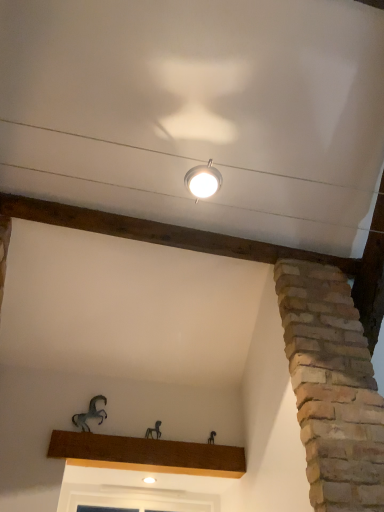
Question: Considering the relative sizes of metallic horse at center, the 1th animal in the right-to-left sequence, and metallic horse at lower left, placed as the second animal when sorted from bottom to top, in the image provided, is metallic horse at center, the 1th animal in the right-to-left sequence, smaller than metallic horse at lower left, placed as the second animal when sorted from bottom to top,?

Choices:
 (A) no
 (B) yes

Answer: (B)

Question: Is metallic horse at center, arranged as the first animal when ordered from the bottom, far from metallic horse at lower left, placed as the second animal when sorted from bottom to top?

Choices:
 (A) no
 (B) yes

Answer: (A)

Question: Is metallic horse at center, arranged as the first animal when ordered from the bottom, facing away from metallic horse at lower left, placed as the second animal when sorted from bottom to top?

Choices:
 (A) yes
 (B) no

Answer: (B)

Question: From a real-world perspective, is metallic horse at center, positioned as the second animal in top-to-bottom order, beneath metallic horse at lower left, which is the first animal from left to right?

Choices:
 (A) yes
 (B) no

Answer: (A)

Question: From the image's perspective, would you say metallic horse at center, positioned as the second animal in top-to-bottom order, is positioned over metallic horse at lower left, placed as the second animal when sorted from bottom to top?

Choices:
 (A) no
 (B) yes

Answer: (A)

Question: Is metallic horse at lower left, marked as the second animal in a right-to-left arrangement, taller or shorter than metallic horse at center, arranged as the first animal when ordered from the bottom?

Choices:
 (A) short
 (B) tall

Answer: (B)

Question: Which is correct: metallic horse at lower left, which is the first animal from left to right, is inside metallic horse at center, arranged as the first animal when ordered from the bottom, or outside of it?

Choices:
 (A) outside
 (B) inside

Answer: (A)

Question: Considering their positions, is metallic horse at lower left, placed as the second animal when sorted from bottom to top, located in front of or behind metallic horse at center, which appears as the 2th animal when viewed from the left?

Choices:
 (A) front
 (B) behind

Answer: (A)

Question: Based on their positions, is metallic horse at lower left, placed as the second animal when sorted from bottom to top, located to the left or right of metallic horse at center, the 1th animal in the right-to-left sequence?

Choices:
 (A) right
 (B) left

Answer: (B)

Question: In terms of height, does metallic horse at lower left, acting as the first animal starting from the top, look taller or shorter compared to matte silver lamp at upper center?

Choices:
 (A) tall
 (B) short

Answer: (A)

Question: In terms of size, does metallic horse at lower left, placed as the second animal when sorted from bottom to top, appear bigger or smaller than matte silver lamp at upper center?

Choices:
 (A) big
 (B) small

Answer: (B)

Question: Looking at their shapes, would you say metallic horse at lower left, which is the first animal from left to right, is wider or thinner than matte silver lamp at upper center?

Choices:
 (A) thin
 (B) wide

Answer: (A)

Question: Visually, is metallic horse at lower left, placed as the second animal when sorted from bottom to top, positioned to the left or to the right of matte silver lamp at upper center?

Choices:
 (A) right
 (B) left

Answer: (B)

Question: From the image's perspective, relative to metallic horse at lower left, which is the first animal from left to right, is metallic horse at center, which appears as the 2th animal when viewed from the left, above or below?

Choices:
 (A) above
 (B) below

Answer: (B)

Question: Choose the correct answer: Is metallic horse at center, the 1th animal in the right-to-left sequence, inside metallic horse at lower left, which is the first animal from left to right, or outside it?

Choices:
 (A) outside
 (B) inside

Answer: (A)